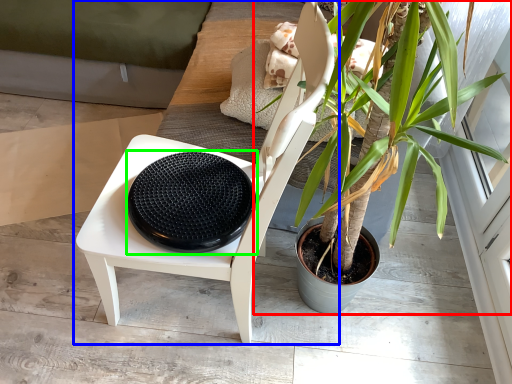
Question: Which object is the closest to the houseplant (highlighted by a red box)? Choose among these: chair (highlighted by a blue box) or footrest (highlighted by a green box).

Choices:
 (A) chair
 (B) footrest

Answer: (A)